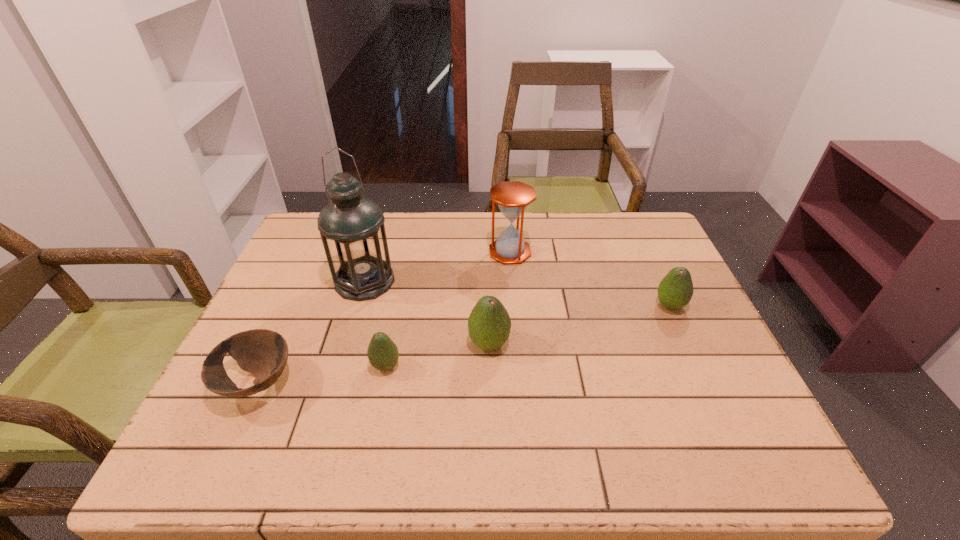
To achieve even spacing by inserting another avocado among them, please point to a vacant spot for this new avocado. Please provide its 2D coordinates. Your answer should be formatted as a tuple, i.e. [(x, y)], where the tuple contains the x and y coordinates of a point satisfying the conditions above.

[(584, 324)]